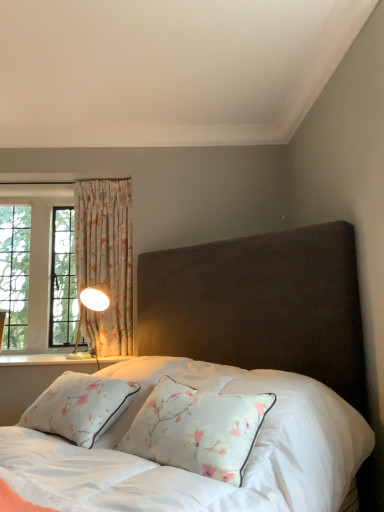
Question: Considering the relative sizes of velvet dark brown bed at center and metallic gold table lamp at left in the image provided, is velvet dark brown bed at center bigger than metallic gold table lamp at left?

Choices:
 (A) yes
 (B) no

Answer: (A)

Question: From a real-world perspective, does velvet dark brown bed at center stand above metallic gold table lamp at left?

Choices:
 (A) yes
 (B) no

Answer: (B)

Question: From the image's perspective, does velvet dark brown bed at center appear lower than metallic gold table lamp at left?

Choices:
 (A) no
 (B) yes

Answer: (B)

Question: From the image's perspective, does velvet dark brown bed at center appear higher than metallic gold table lamp at left?

Choices:
 (A) yes
 (B) no

Answer: (B)

Question: Is velvet dark brown bed at center further to camera compared to metallic gold table lamp at left?

Choices:
 (A) yes
 (B) no

Answer: (B)

Question: In terms of height, does metallic gold table lamp at left look taller or shorter compared to white painted wood at lower left?

Choices:
 (A) tall
 (B) short

Answer: (A)

Question: Based on their positions, is metallic gold table lamp at left located to the left or right of white painted wood at lower left?

Choices:
 (A) left
 (B) right

Answer: (B)

Question: From a real-world perspective, is metallic gold table lamp at left physically located above or below white painted wood at lower left?

Choices:
 (A) below
 (B) above

Answer: (B)

Question: From the image's perspective, is metallic gold table lamp at left positioned above or below white painted wood at lower left?

Choices:
 (A) below
 (B) above

Answer: (B)

Question: Is floral fabric curtain at left wider or thinner than metallic gold table lamp at left?

Choices:
 (A) wide
 (B) thin

Answer: (B)

Question: Looking at the image, does floral fabric curtain at left seem bigger or smaller compared to metallic gold table lamp at left?

Choices:
 (A) big
 (B) small

Answer: (A)

Question: In the image, is floral fabric curtain at left positioned in front of or behind metallic gold table lamp at left?

Choices:
 (A) behind
 (B) front

Answer: (A)

Question: From the image's perspective, is floral fabric curtain at left above or below metallic gold table lamp at left?

Choices:
 (A) below
 (B) above

Answer: (B)

Question: From a real-world perspective, is white painted wood at lower left above or below floral fabric curtain at left?

Choices:
 (A) above
 (B) below

Answer: (B)

Question: Considering the relative positions of white painted wood at lower left and floral fabric curtain at left in the image provided, is white painted wood at lower left to the left or to the right of floral fabric curtain at left?

Choices:
 (A) left
 (B) right

Answer: (A)